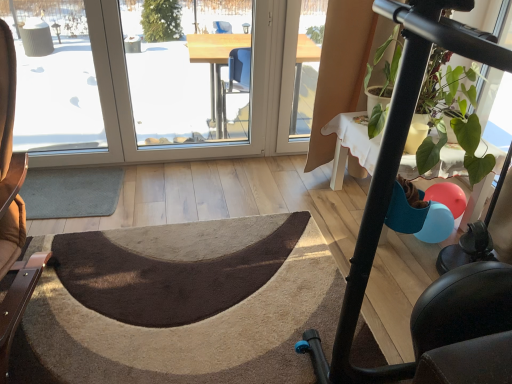
What are the coordinates of `spots to the right of gray carpet at lower left, which is the first doormat in top-to-bottom order` in the screenshot? It's located at 154,196.